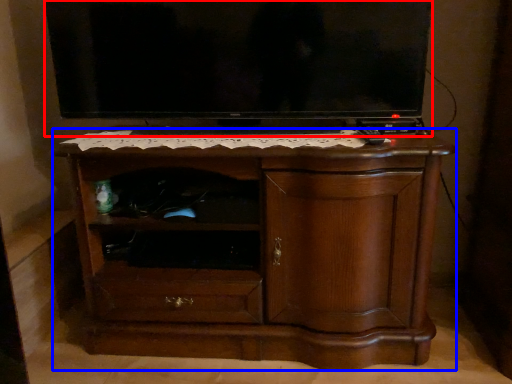
Question: Which point is further to the camera, television (highlighted by a red box) or chest of drawers (highlighted by a blue box)?

Choices:
 (A) television
 (B) chest of drawers

Answer: (A)